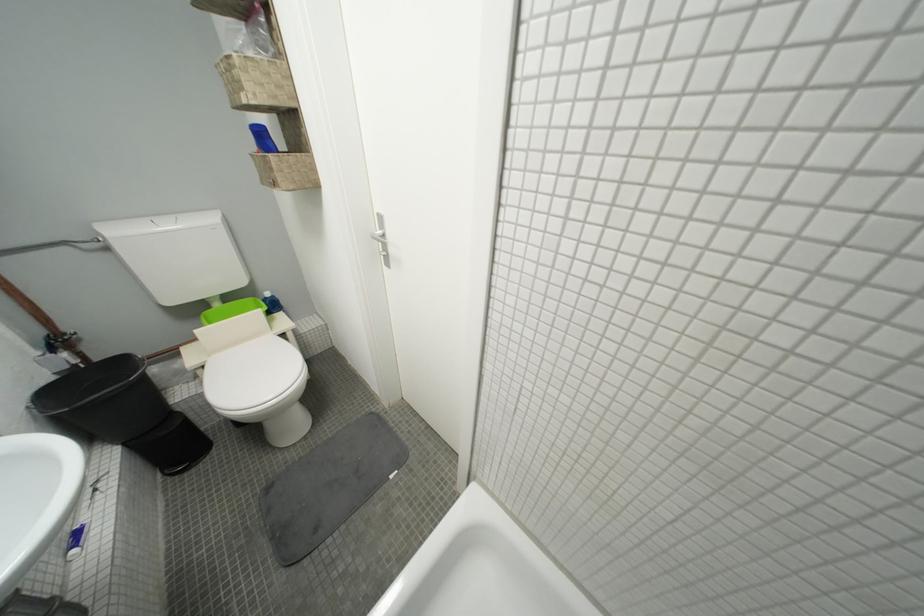
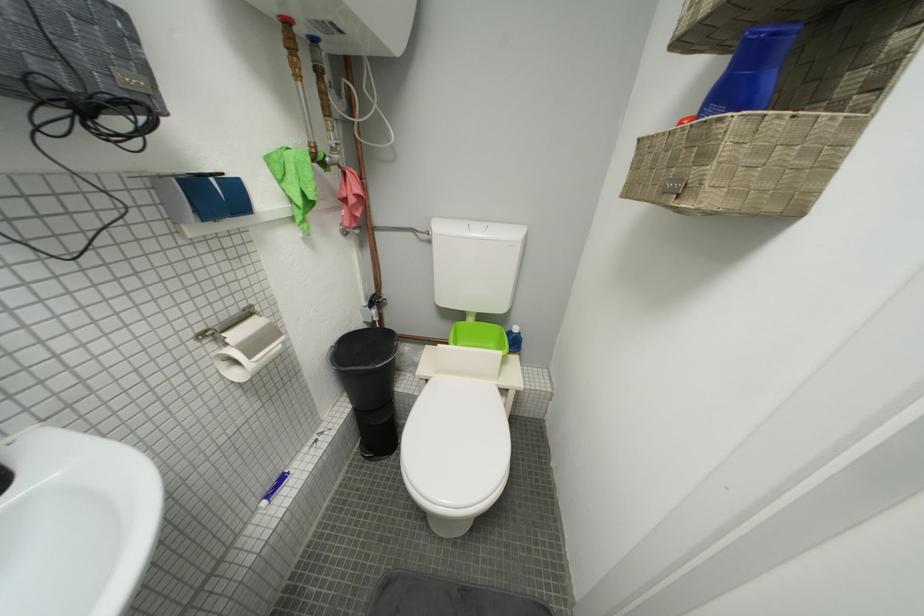
Question: How did the camera likely rotate?

Choices:
 (A) Left
 (B) Right
 (C) Up
 (D) Down

Answer: (A)